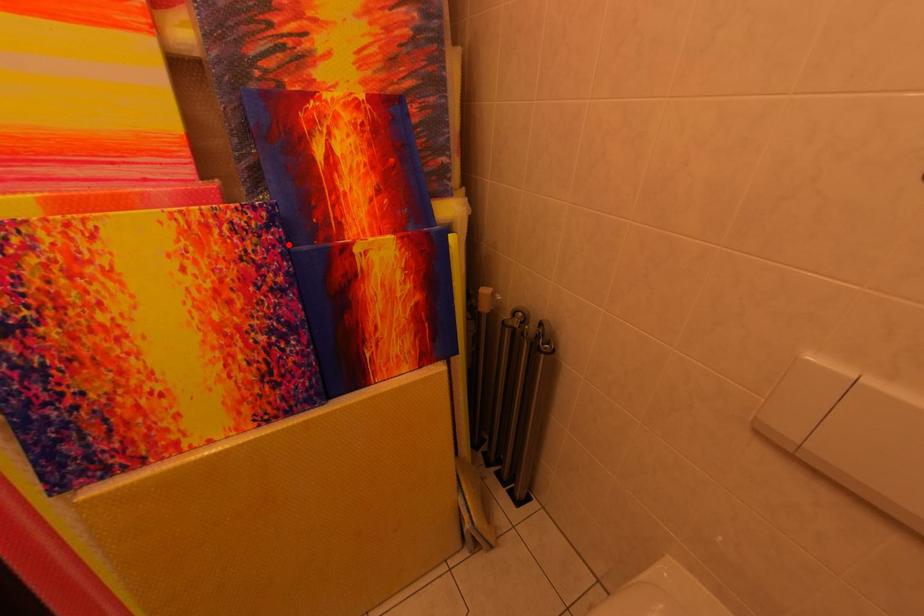
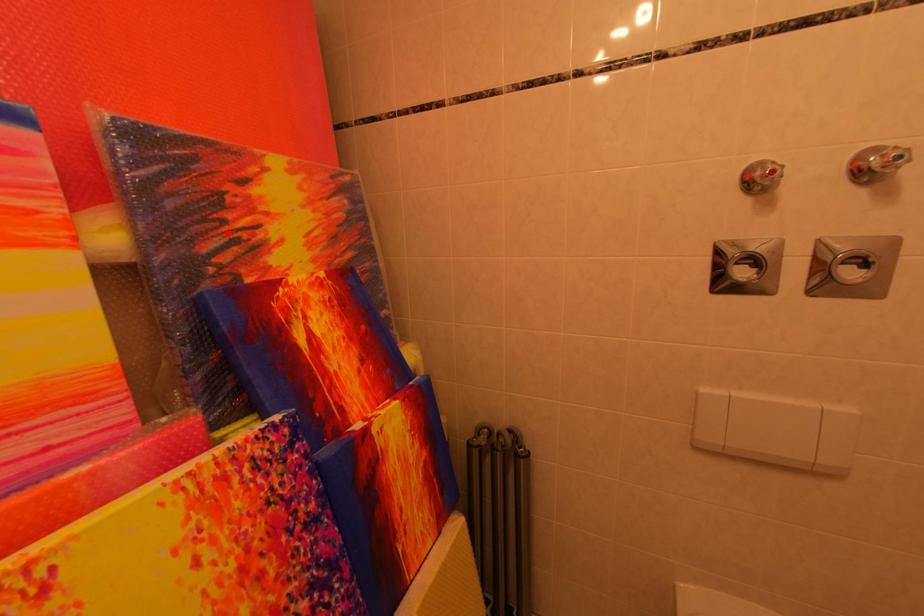
I am providing you with two images of the same scene from different viewpoints. A red point is marked on the first image and another point is marked on the second image. Are the points marked in image1 and image2 representing the same 3D position?

No